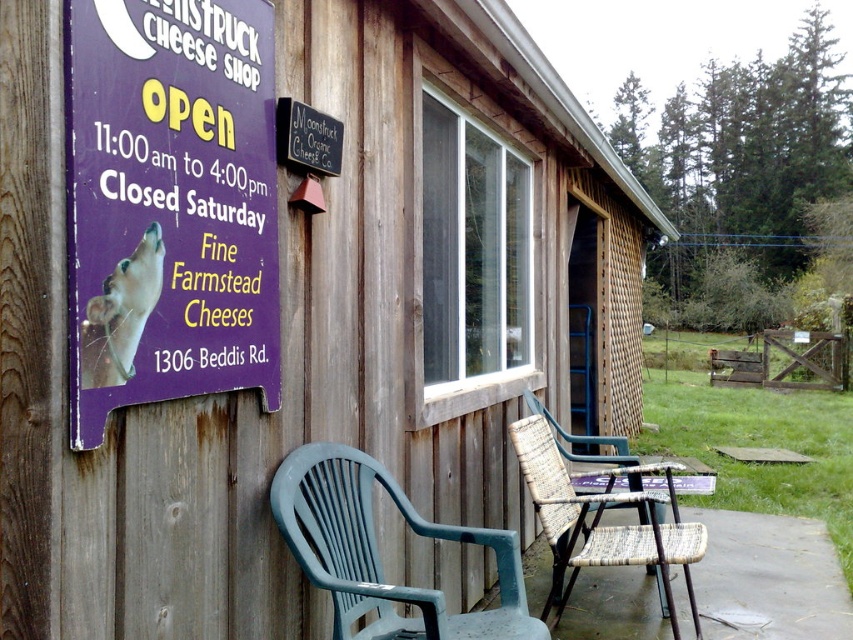
Is purple wood sign at left below white fur dog at left?

Incorrect, purple wood sign at left is not positioned below white fur dog at left.

Which is behind, point (123, 385) or point (100, 332)?

The point (123, 385) is more distant.

This screenshot has height=640, width=853. Describe the element at coordinates (169, 204) in the screenshot. I see `purple wood sign at left` at that location.

Where is `purple wood sign at left`? The height and width of the screenshot is (640, 853). purple wood sign at left is located at coordinates (169, 204).

Who is more forward, (548,608) or (100,372)?

Positioned in front is point (100,372).

The image size is (853, 640). Find the location of `woven brown chair at lower center`. woven brown chair at lower center is located at coordinates (599, 518).

This screenshot has height=640, width=853. Describe the element at coordinates (169, 204) in the screenshot. I see `purple wood sign at left` at that location.

Between purple wood sign at left and woven brown chair at lower center, which one has less height?

woven brown chair at lower center is shorter.

Is point (123, 316) positioned behind point (595, 515)?

No, it is not.

Locate an element on the screen. The image size is (853, 640). purple wood sign at left is located at coordinates (169, 204).